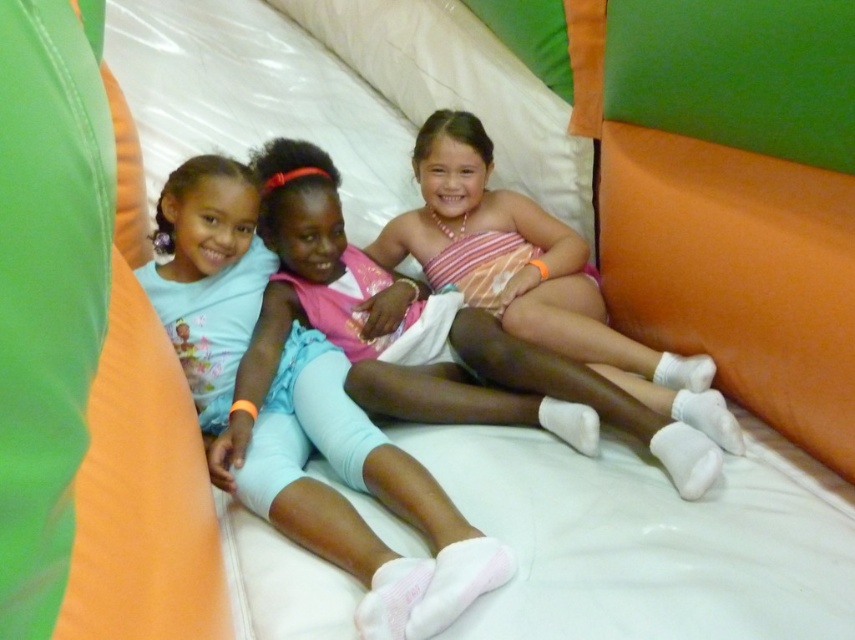
Question: Which point is closer to the camera?

Choices:
 (A) (233, 237)
 (B) (702, 490)

Answer: (B)

Question: Which point is farther from the camera taking this photo?

Choices:
 (A) (457, 561)
 (B) (569, 413)

Answer: (B)

Question: Which point is farther to the camera?

Choices:
 (A) light blue fabric pants at center
 (B) light blue leggings at center

Answer: (B)

Question: Does light blue fabric pants at center appear on the left side of light blue leggings at center?

Choices:
 (A) yes
 (B) no

Answer: (A)

Question: Does light blue fabric pants at center come in front of light blue leggings at center?

Choices:
 (A) yes
 (B) no

Answer: (A)

Question: Can you confirm if light blue fabric pants at center is wider than light blue leggings at center?

Choices:
 (A) no
 (B) yes

Answer: (A)